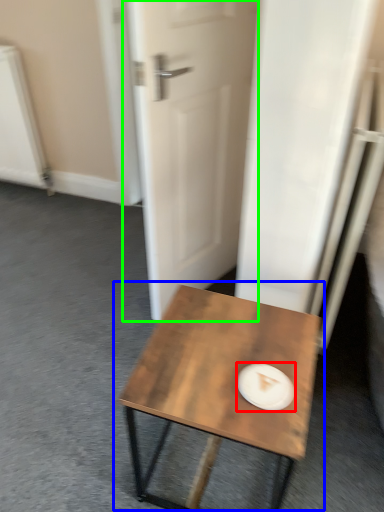
Question: Estimate the real-world distances between objects in this image. Which object is farther from paper plate (highlighted by a red box), coffee table (highlighted by a blue box) or door (highlighted by a green box)?

Choices:
 (A) coffee table
 (B) door

Answer: (B)